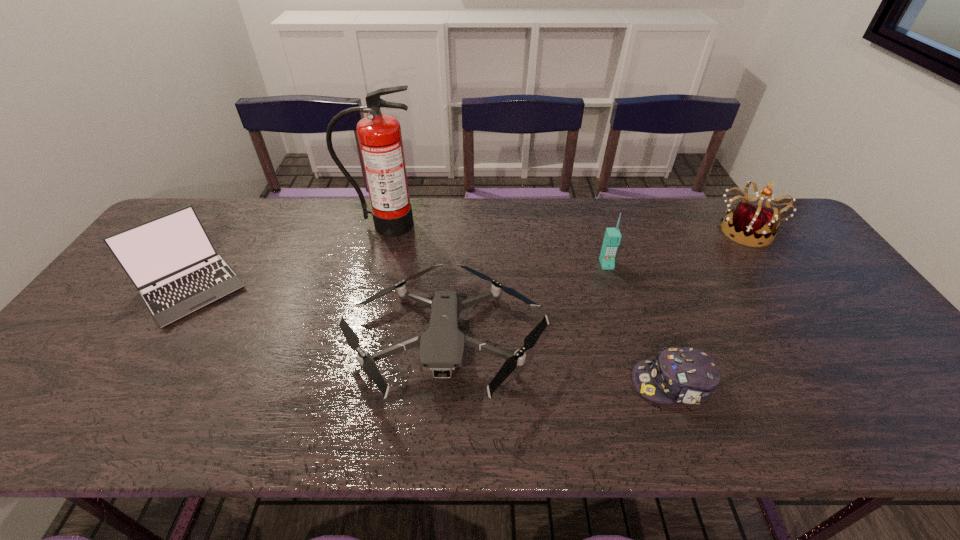
Find the location of a particular element. This screenshot has height=540, width=960. vacant space at the far edge is located at coordinates (523, 237).

This screenshot has width=960, height=540. I want to click on vacant position at the near edge of the desktop, so click(x=386, y=409).

In the image, there is a desktop. Where is `vacant area at the right edge`? The image size is (960, 540). vacant area at the right edge is located at coordinates (906, 396).

The image size is (960, 540). Find the location of `vacant area that lies between the drone and the shortest object`. vacant area that lies between the drone and the shortest object is located at coordinates (559, 362).

Where is `vacant region between the rightmost object and the fire extinguisher`? The height and width of the screenshot is (540, 960). vacant region between the rightmost object and the fire extinguisher is located at coordinates (565, 227).

You are a GUI agent. You are given a task and a screenshot of the screen. Output one action in this format:
    pyautogui.click(x=<x>, y=<y>)
    Task: Click on the vacant space that is in between the second shortest object and the rightmost object
    Image resolution: width=960 pixels, height=540 pixels.
    Given the screenshot: What is the action you would take?
    pyautogui.click(x=595, y=286)

Locate an element on the screen. This screenshot has height=540, width=960. vacant area that lies between the drone and the tallest object is located at coordinates (416, 283).

Identify the location of vacant space that is in between the rightmost object and the headwear. Image resolution: width=960 pixels, height=540 pixels. (708, 307).

Identify the location of free space between the drone and the leftmost object. Image resolution: width=960 pixels, height=540 pixels. (319, 314).

Identify the location of blank region between the fifth tallest object and the fire extinguisher. This screenshot has width=960, height=540. (416, 283).